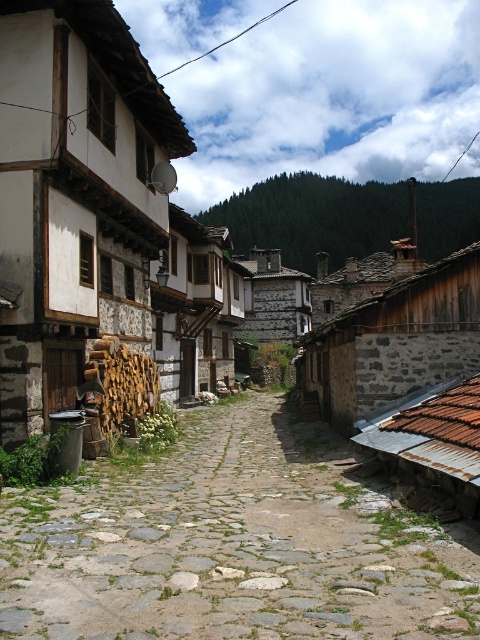
Question: Which of the following is the farthest from the observer?

Choices:
 (A) rustic stone hut at center
 (B) wooden log pile at left

Answer: (A)

Question: Does wooden log pile at left have a lesser width compared to stone textured hut at center?

Choices:
 (A) yes
 (B) no

Answer: (A)

Question: Is natural stone cobblestone path at center below stone textured hut at center?

Choices:
 (A) no
 (B) yes

Answer: (B)

Question: From the image, what is the correct spatial relationship of natural stone cobblestone path at center in relation to wooden log pile at left?

Choices:
 (A) right
 (B) left

Answer: (A)

Question: Which is nearer to the wooden log pile at left?

Choices:
 (A) stone textured hut at center
 (B) natural stone cobblestone path at center

Answer: (B)

Question: Which object appears closest to the camera in this image?

Choices:
 (A) rustic stone hut at center
 (B) stone textured hut at center

Answer: (A)